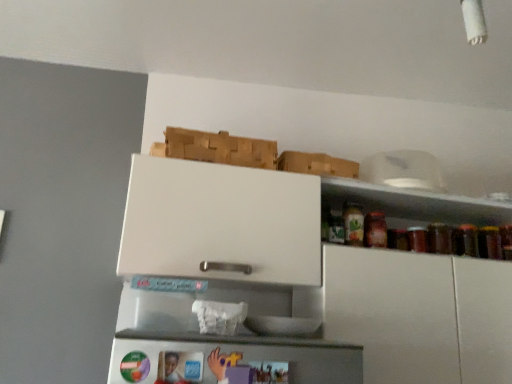
In order to face wooden puzzle at upper center, should I rotate leftwards or rightwards?

Rotate left and turn 4.809 degrees.

This screenshot has width=512, height=384. What do you see at coordinates (220, 148) in the screenshot?
I see `wooden puzzle at upper center` at bounding box center [220, 148].

Locate an element on the screen. wooden puzzle at upper center is located at coordinates (x=220, y=148).

Measure the distance between point (x=187, y=149) and camera.

The depth of point (x=187, y=149) is 1.31 meters.

The height and width of the screenshot is (384, 512). I want to click on wooden puzzle at upper center, so click(x=220, y=148).